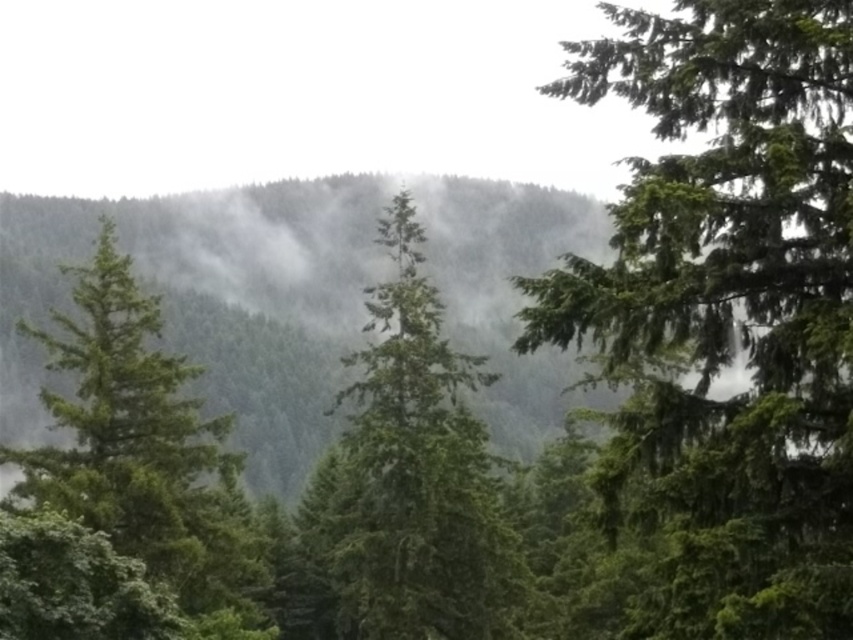
Is green matte tree at upper right thinner than green matte tree at center?

Yes.

Which is above, green matte tree at upper right or green matte tree at center?

green matte tree at upper right is higher up.

Identify the location of green matte tree at upper right. (728, 310).

Is green matte tree at center positioned at the back of green matte tree at left?

Yes, green matte tree at center is behind green matte tree at left.

Which is behind, point (386, 433) or point (233, 624)?

Positioned behind is point (386, 433).

Is point (440, 419) farther from viewer compared to point (83, 436)?

Yes, it is.

You are a GUI agent. You are given a task and a screenshot of the screen. Output one action in this format:
    pyautogui.click(x=<x>, y=<y>)
    Task: Click on the green matte tree at center
    
    Given the screenshot: What is the action you would take?
    pyautogui.click(x=412, y=477)

Looking at this image, can you confirm if green matte tree at upper right is positioned below green matte tree at left?

No, green matte tree at upper right is not below green matte tree at left.

Does point (730, 564) come farther from viewer compared to point (67, 397)?

No, it is not.

Where is `green matte tree at upper right`? The image size is (853, 640). green matte tree at upper right is located at coordinates (728, 310).